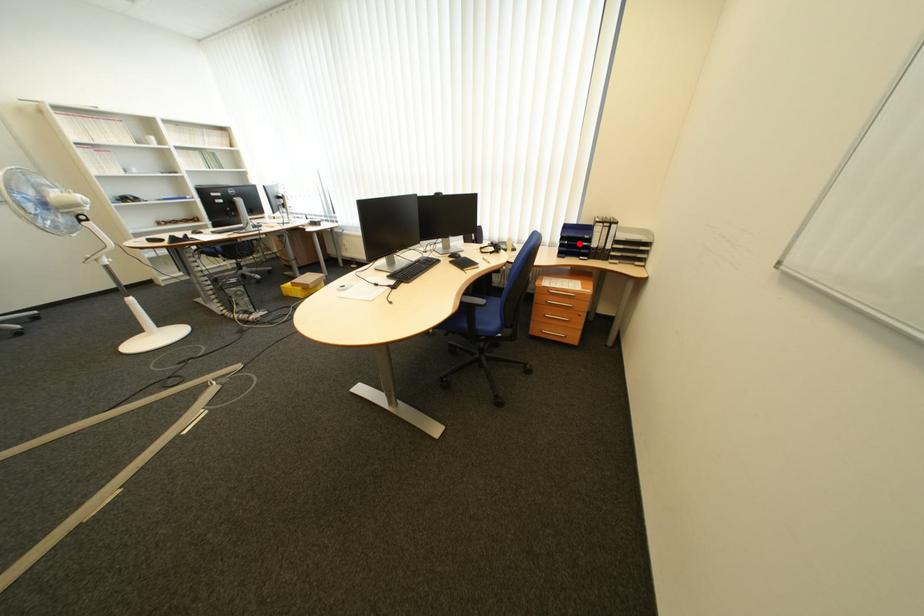
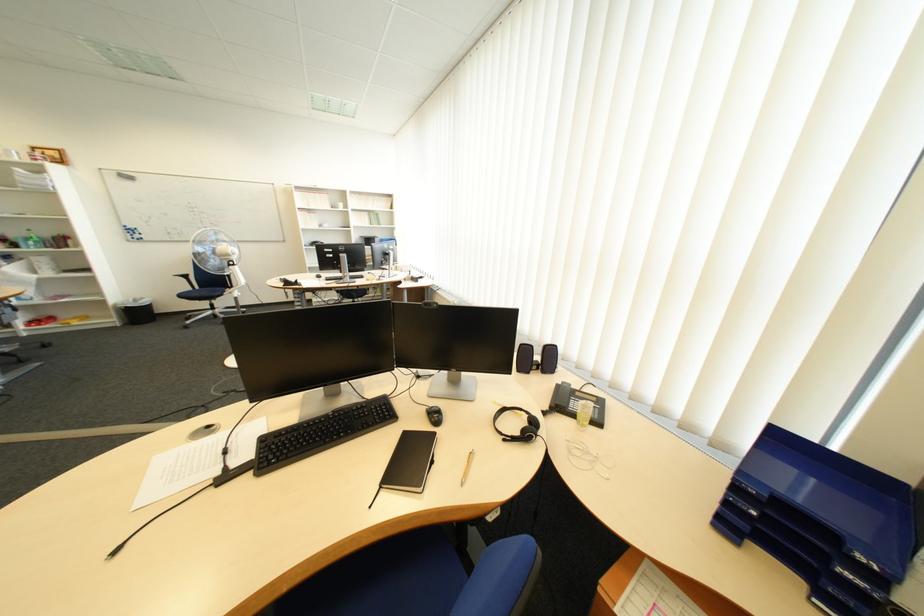
In the second image, find the point that corresponds to the highlighted location in the first image.

(767, 514)